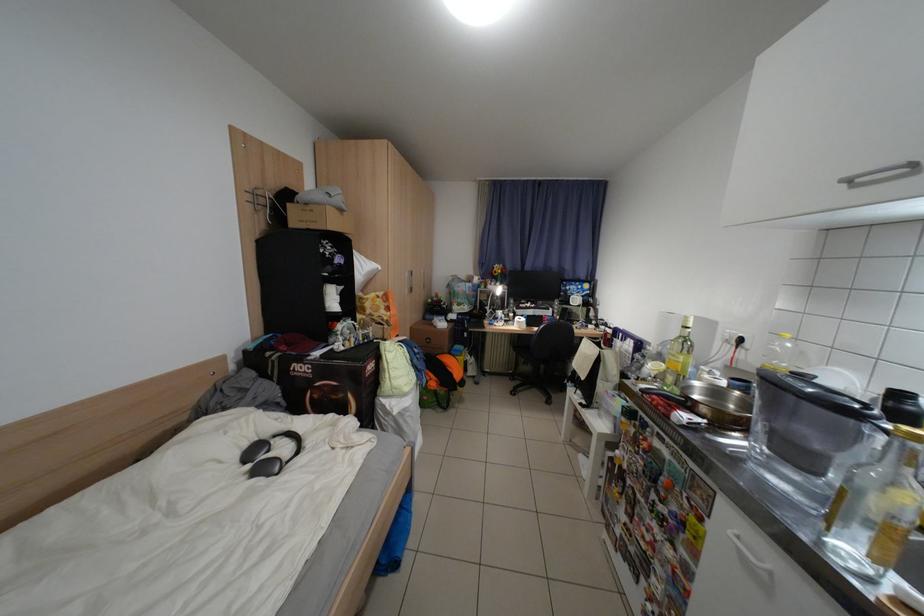
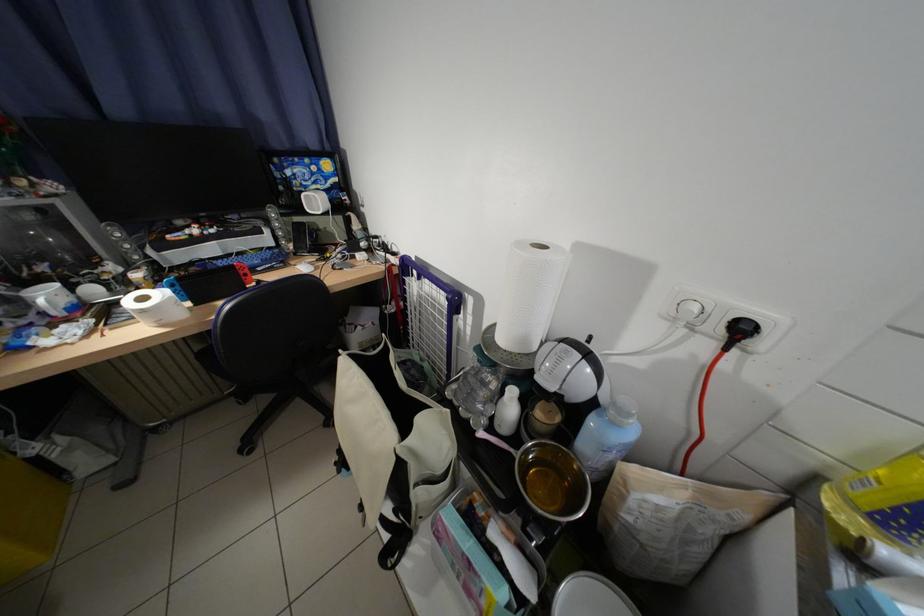
The point at (752,342) is marked in the first image. Where is the corresponding point in the second image?

(754, 331)